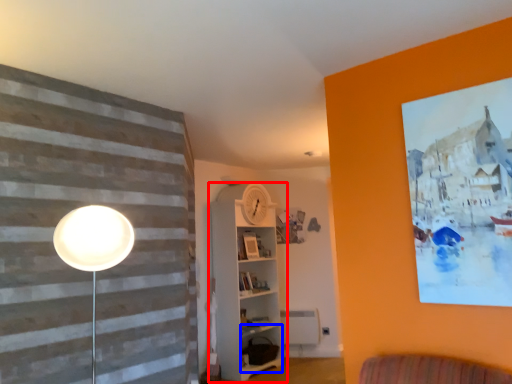
Question: Which of the following is the farthest to the observer, shelf (highlighted by a red box) or shelf (highlighted by a blue box)?

Choices:
 (A) shelf
 (B) shelf

Answer: (B)